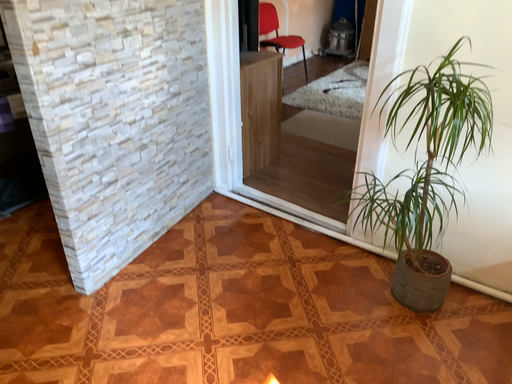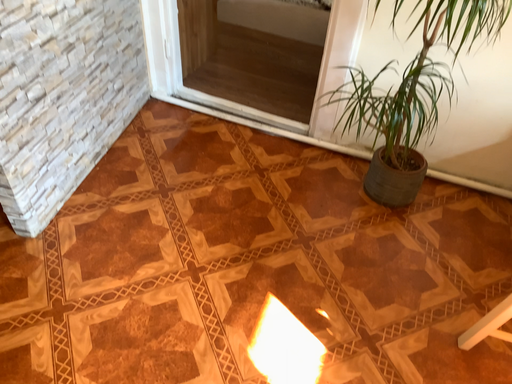
Question: Which way did the camera rotate in the video?

Choices:
 (A) rotated right
 (B) rotated left

Answer: (A)